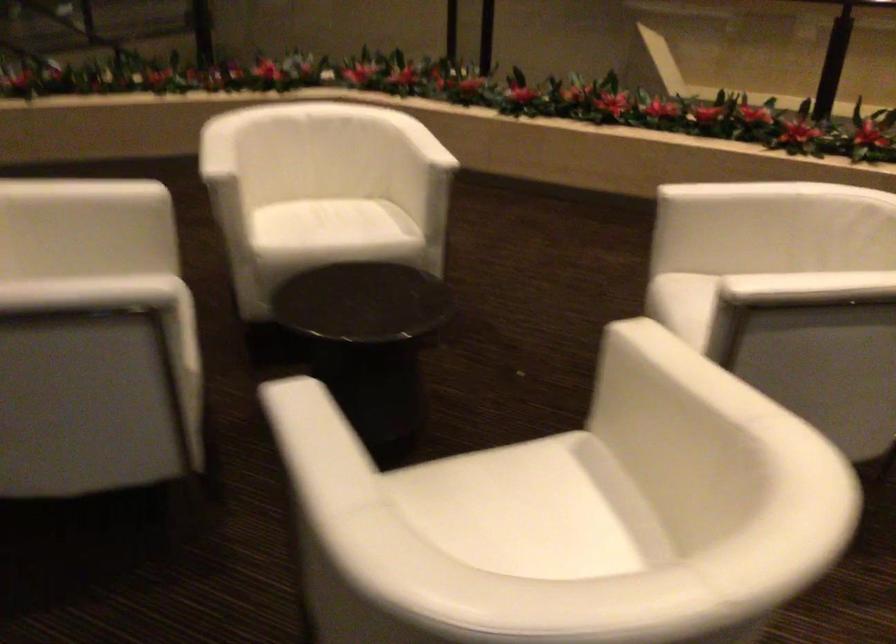
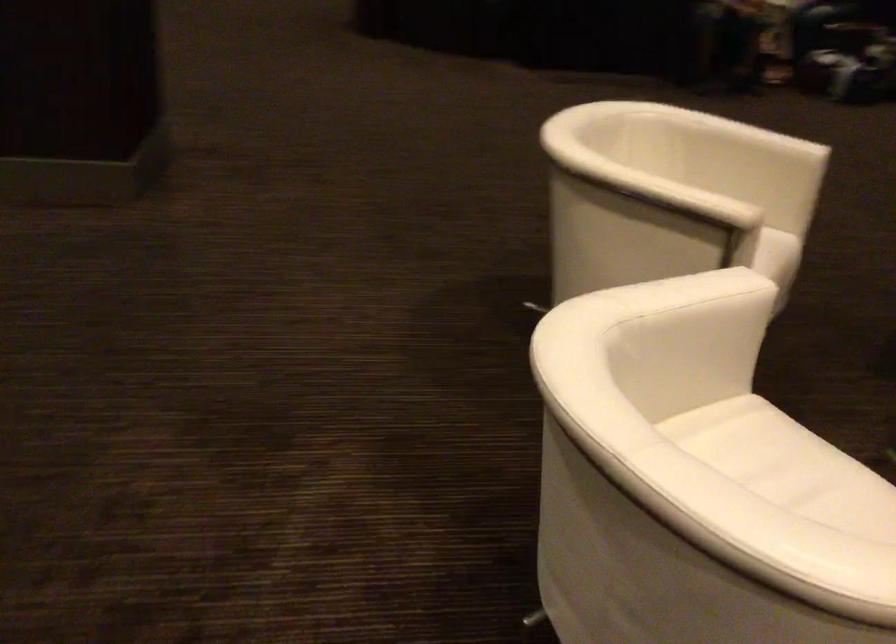
Where in the second image is the point corresponding to [676,426] from the first image?

(676, 261)